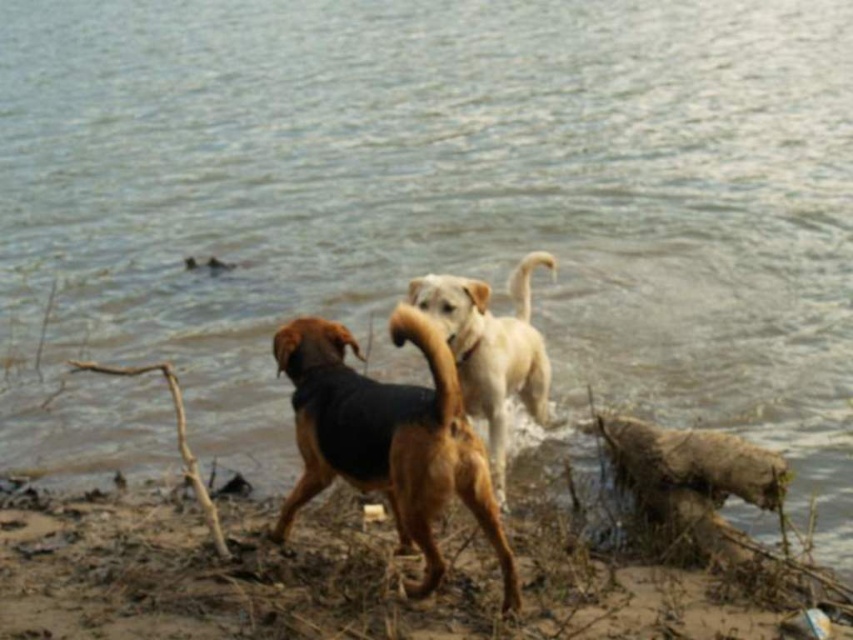
Between brown fur dog at center and light brown fur dog at center, which one appears on the right side from the viewer's perspective?

light brown fur dog at center

The width and height of the screenshot is (853, 640). Describe the element at coordinates (387, 436) in the screenshot. I see `brown fur dog at center` at that location.

Find the location of a particular element. The width and height of the screenshot is (853, 640). brown fur dog at center is located at coordinates (387, 436).

Does point (61, 625) lie in front of point (512, 324)?

Yes, it is.

Which of these two, brown dirt shoreline at lower left or light brown fur dog at center, stands taller?

light brown fur dog at center is taller.

Image resolution: width=853 pixels, height=640 pixels. What are the coordinates of `brown dirt shoreline at lower left` in the screenshot? It's located at (329, 580).

You are a GUI agent. You are given a task and a screenshot of the screen. Output one action in this format:
    pyautogui.click(x=<x>, y=<y>)
    Task: Click on the brown dirt shoreline at lower left
    This screenshot has width=853, height=640.
    Given the screenshot: What is the action you would take?
    pyautogui.click(x=329, y=580)

Who is positioned more to the right, brown dirt shoreline at lower left or brown fur dog at center?

brown fur dog at center is more to the right.

Which is behind, point (306, 579) or point (404, 413)?

Positioned behind is point (306, 579).

Is point (85, 540) closer to viewer compared to point (379, 481)?

No, it is not.

Where is `brown dirt shoreline at lower left`? This screenshot has height=640, width=853. brown dirt shoreline at lower left is located at coordinates (329, 580).